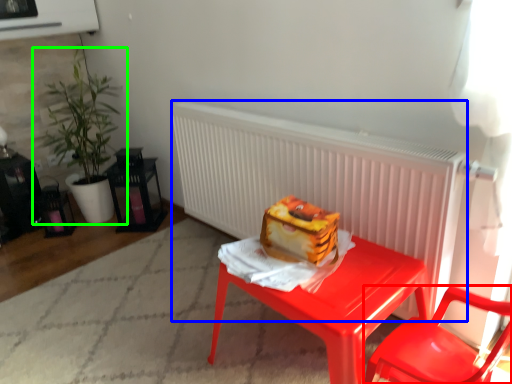
Question: Considering the real-world distances, which object is farthest from chair (highlighted by a red box)? radiator (highlighted by a blue box) or houseplant (highlighted by a green box)?

Choices:
 (A) radiator
 (B) houseplant

Answer: (B)